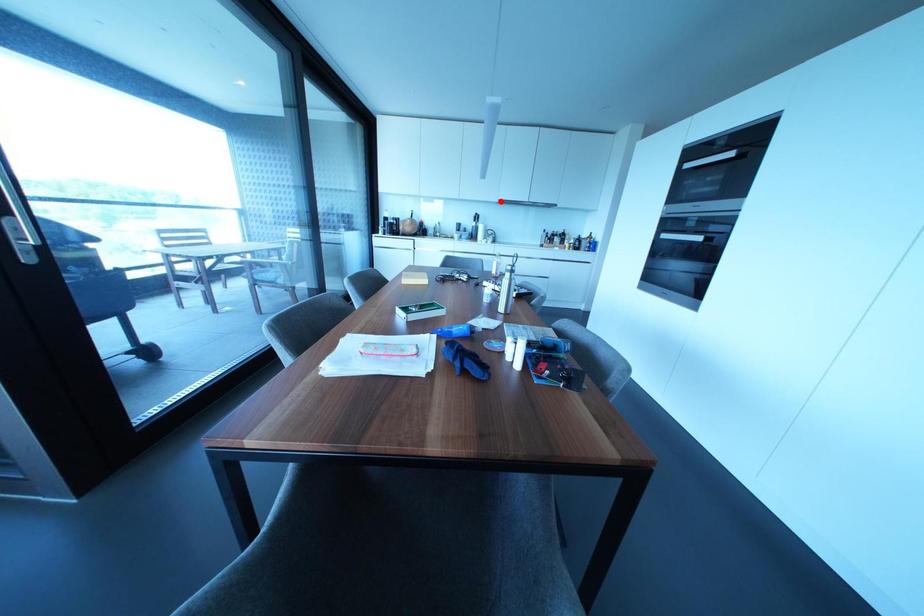
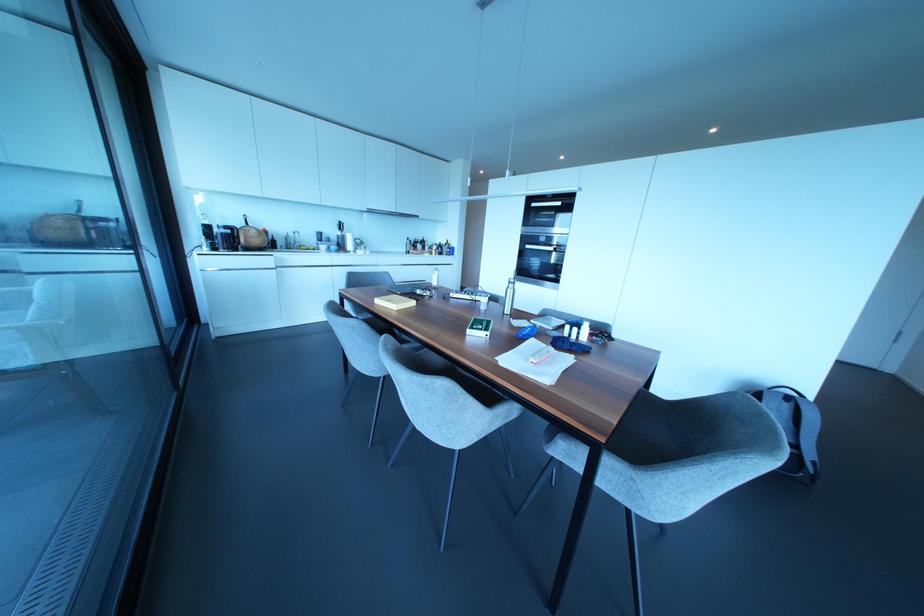
In the second image, find the point that corresponds to the highlighted location in the first image.

(370, 209)